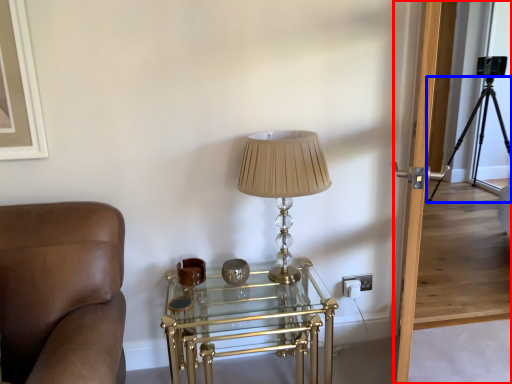
Question: Which of the following is the farthest to the observer, glass door (highlighted by a red box) or tripod (highlighted by a blue box)?

Choices:
 (A) glass door
 (B) tripod

Answer: (B)